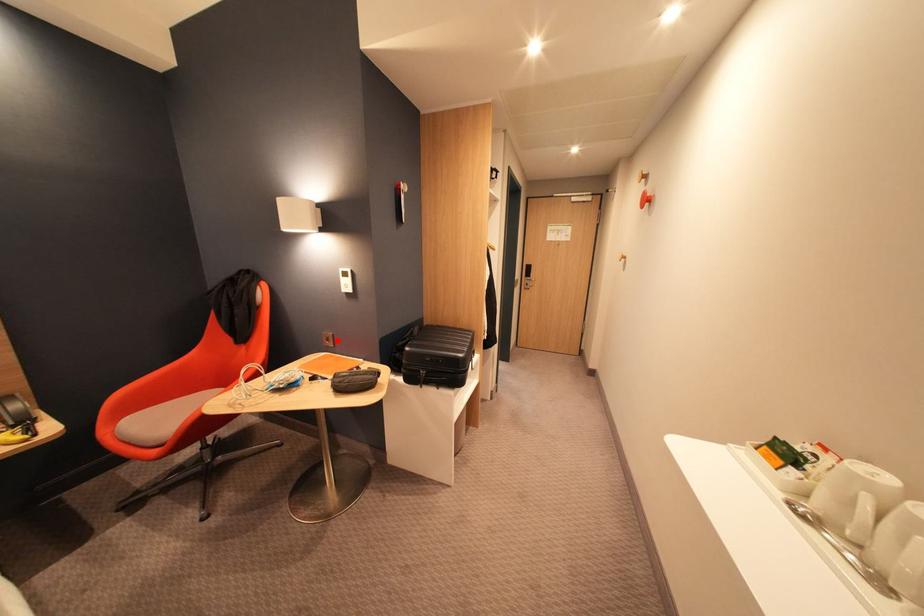
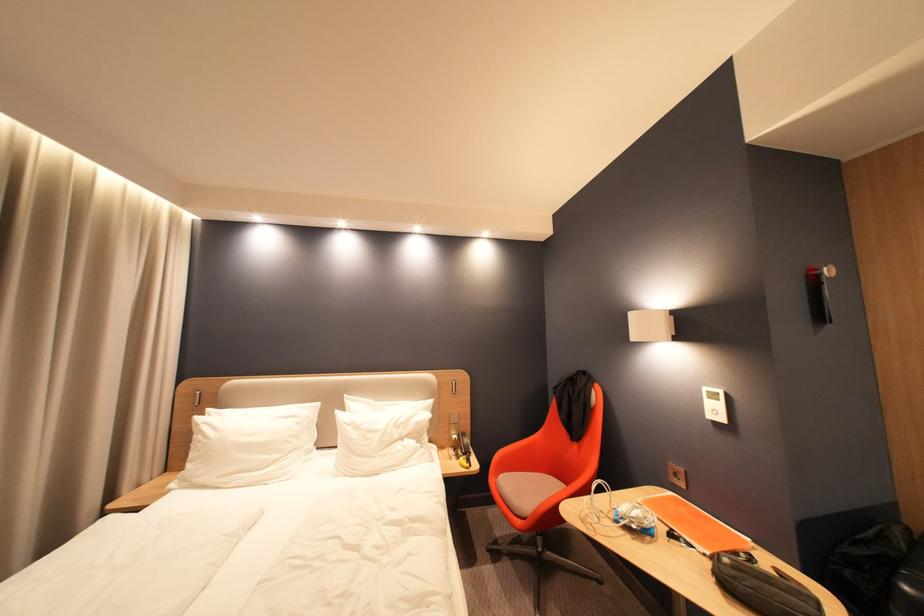
The point at the highlighted location is marked in the first image. Where is the corresponding point in the second image?

(686, 476)